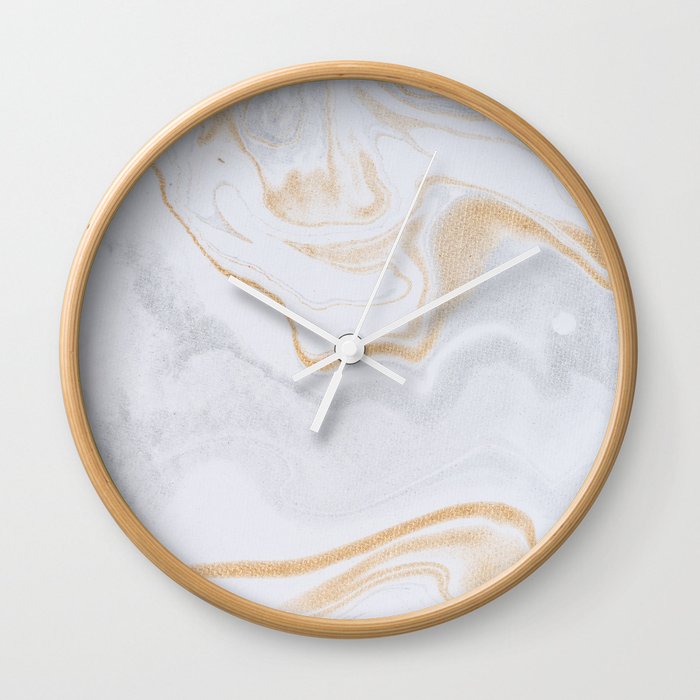
Locate an element on the screen. clock is located at coordinates click(x=516, y=452).